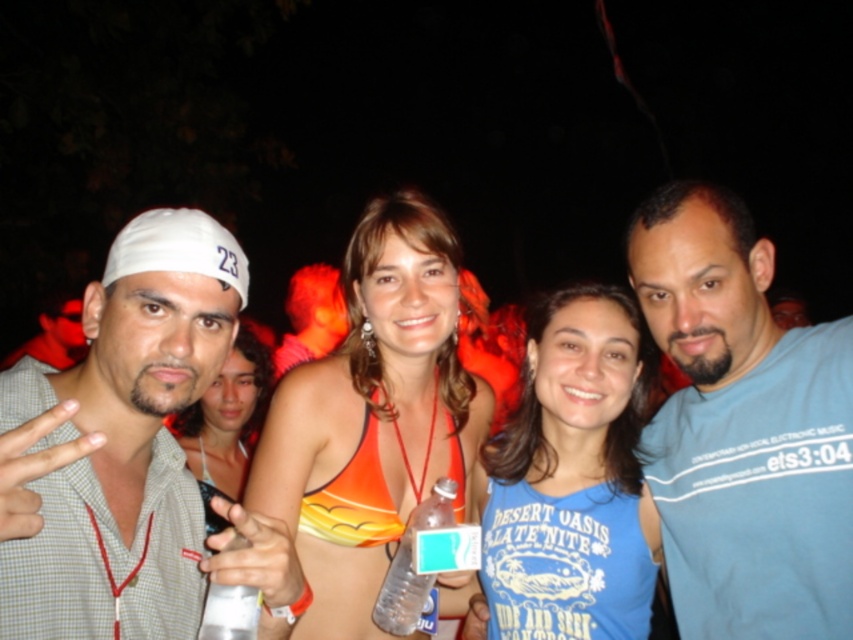
Between white fabric cap at left and orange fabric bikini top at center, which one has more height?

With more height is orange fabric bikini top at center.

At what (x,y) coordinates should I click in order to perform the action: click on white fabric cap at left. Please return your answer as a coordinate pair (x, y). Image resolution: width=853 pixels, height=640 pixels. Looking at the image, I should click on pos(128,451).

Can you confirm if orange fabric bikini top at center is positioned above clear plastic bottle at center?

Yes, orange fabric bikini top at center is above clear plastic bottle at center.

Is point (364, 285) less distant than point (392, 560)?

No.

Who is more forward, (492,404) or (392,563)?

Point (392,563) is more forward.

Identify the location of orange fabric bikini top at center. (372, 416).

In the scene shown: Is blue cotton tank top at center below clear plastic bottle at center?

Incorrect, blue cotton tank top at center is not positioned below clear plastic bottle at center.

What do you see at coordinates (575, 470) in the screenshot? The height and width of the screenshot is (640, 853). I see `blue cotton tank top at center` at bounding box center [575, 470].

Which is in front, point (605, 413) or point (403, 618)?

Point (403, 618)

You are a GUI agent. You are given a task and a screenshot of the screen. Output one action in this format:
    pyautogui.click(x=<x>, y=<y>)
    Task: Click on the blue cotton tank top at center
    The image size is (853, 640).
    Given the screenshot: What is the action you would take?
    pos(575,470)